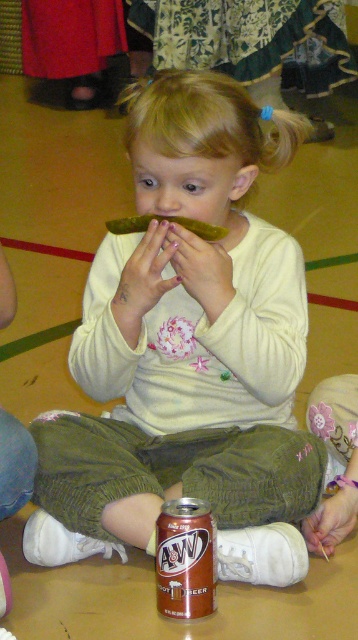
Is matte yellow banana at center to the left of smooth skin hand at lower right from the viewer's perspective?

Yes, matte yellow banana at center is to the left of smooth skin hand at lower right.

Is matte yellow banana at center smaller than smooth skin hand at lower right?

No, matte yellow banana at center is not smaller than smooth skin hand at lower right.

Who is more distant from viewer, (181, 243) or (331, 538)?

The point (331, 538) is behind.

Where is `matte yellow banana at center`? matte yellow banana at center is located at coordinates (200, 269).

Is pale skin at center to the left of smooth skin hand at lower right from the viewer's perspective?

Yes, pale skin at center is to the left of smooth skin hand at lower right.

Is pale skin at center below smooth skin hand at lower right?

Incorrect, pale skin at center is not positioned below smooth skin hand at lower right.

Describe the element at coordinates (143, 276) in the screenshot. I see `pale skin at center` at that location.

Where is `pale skin at center`? This screenshot has height=640, width=358. pale skin at center is located at coordinates (143, 276).

Does brown matte can at center appear on the right side of green pickled cucumber at center?

Correct, you'll find brown matte can at center to the right of green pickled cucumber at center.

Between point (201, 611) and point (112, 232), which one is positioned in front?

Positioned in front is point (201, 611).

Measure the distance between brown matte can at center and camera.

4.60 feet

Identify the location of brown matte can at center. Image resolution: width=358 pixels, height=640 pixels. (185, 560).